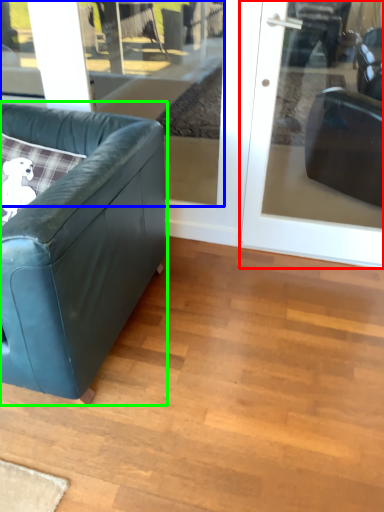
Question: Estimate the real-world distances between objects in this image. Which object is closer to door (highlighted by a red box), window (highlighted by a blue box) or studio couch (highlighted by a green box)?

Choices:
 (A) window
 (B) studio couch

Answer: (B)